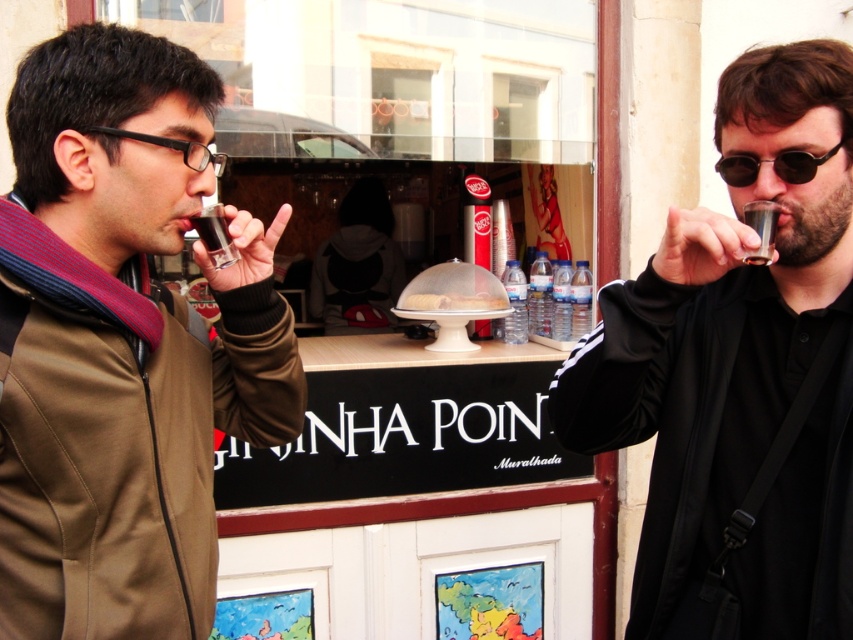
Question: Which point appears closest to the camera in this image?

Choices:
 (A) (747, 184)
 (B) (523, 294)
 (C) (579, 368)

Answer: (A)

Question: Observing the image, what is the correct spatial positioning of transparent plastic water bottles at center in reference to clear plastic water bottles at center?

Choices:
 (A) left
 (B) right

Answer: (B)

Question: From the image, what is the correct spatial relationship of dark matte glass at upper left in relation to transparent plastic water bottles at center?

Choices:
 (A) above
 (B) below

Answer: (A)

Question: Which point is farther to the camera?

Choices:
 (A) clear plastic water at center
 (B) matte black jacket at left
 (C) black plastic glasses at left
 (D) dark brown liquid at upper center

Answer: (A)

Question: Is black plastic goggles at upper right thinner than dark matte glass at upper left?

Choices:
 (A) no
 (B) yes

Answer: (A)

Question: Among these points, which one is farthest from the camera?

Choices:
 (A) (769, 252)
 (B) (798, 179)
 (C) (129, 458)

Answer: (B)